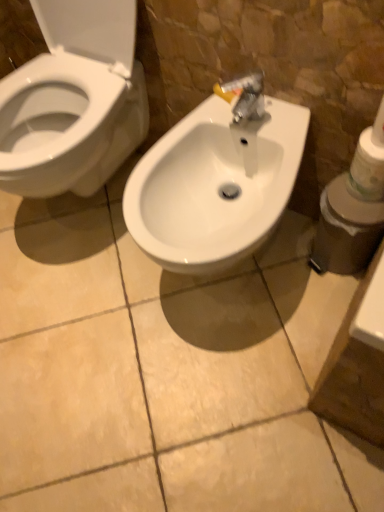
Question: Does white glossy sink at center have a greater width compared to white matte toilet paper at right?

Choices:
 (A) no
 (B) yes

Answer: (B)

Question: Are white glossy sink at center and white matte toilet paper at right located far from each other?

Choices:
 (A) no
 (B) yes

Answer: (A)

Question: From the image's perspective, is white glossy sink at center above white matte toilet paper at right?

Choices:
 (A) no
 (B) yes

Answer: (A)

Question: Considering the relative positions of white glossy sink at center and white matte toilet paper at right in the image provided, is white glossy sink at center behind white matte toilet paper at right?

Choices:
 (A) yes
 (B) no

Answer: (B)

Question: Is white glossy sink at center positioned in front of white matte toilet paper at right?

Choices:
 (A) yes
 (B) no

Answer: (A)

Question: Considering the positions of white matte toilet paper at right and white glossy sink at center in the image, is white matte toilet paper at right wider or thinner than white glossy sink at center?

Choices:
 (A) thin
 (B) wide

Answer: (A)

Question: Considering their positions, is white matte toilet paper at right located in front of or behind white glossy sink at center?

Choices:
 (A) front
 (B) behind

Answer: (B)

Question: Is point (352, 190) positioned closer to the camera than point (240, 131)?

Choices:
 (A) farther
 (B) closer

Answer: (B)

Question: From a real-world perspective, is white matte toilet paper at right positioned above or below white glossy sink at center?

Choices:
 (A) below
 (B) above

Answer: (B)

Question: Is white glossy sink at center wider or thinner than white matte toilet paper at right?

Choices:
 (A) wide
 (B) thin

Answer: (A)

Question: Would you say white glossy sink at center is inside or outside white matte toilet paper at right?

Choices:
 (A) outside
 (B) inside

Answer: (A)

Question: From their relative heights in the image, would you say white glossy sink at center is taller or shorter than white matte toilet paper at right?

Choices:
 (A) tall
 (B) short

Answer: (A)

Question: From the image's perspective, relative to white matte toilet paper at right, is white glossy sink at center above or below?

Choices:
 (A) below
 (B) above

Answer: (A)

Question: Is white plastic container at right situated inside white glossy sink at center or outside?

Choices:
 (A) inside
 (B) outside

Answer: (B)

Question: Visually, is white plastic container at right positioned to the left or to the right of white glossy sink at center?

Choices:
 (A) right
 (B) left

Answer: (A)